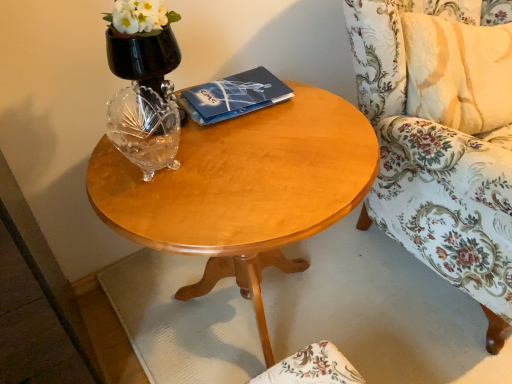
Find the location of a particular element. The height and width of the screenshot is (384, 512). vacant area that is situated to the right of dark blue matte paper at center is located at coordinates tap(308, 111).